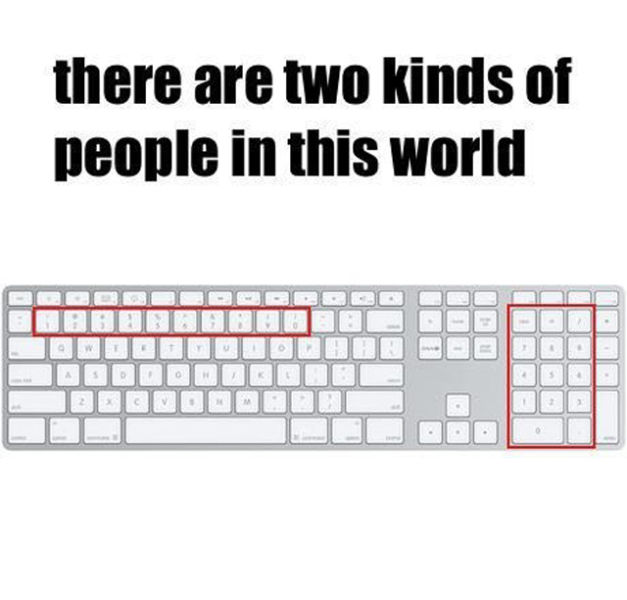
Where is `keyboard`? The image size is (627, 600). keyboard is located at coordinates (414, 379).